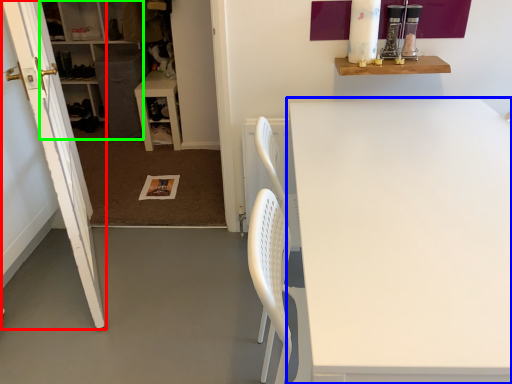
Question: Estimate the real-world distances between objects in this image. Which object is farther from door (highlighted by a red box), table (highlighted by a blue box) or cabinetry (highlighted by a green box)?

Choices:
 (A) table
 (B) cabinetry

Answer: (B)